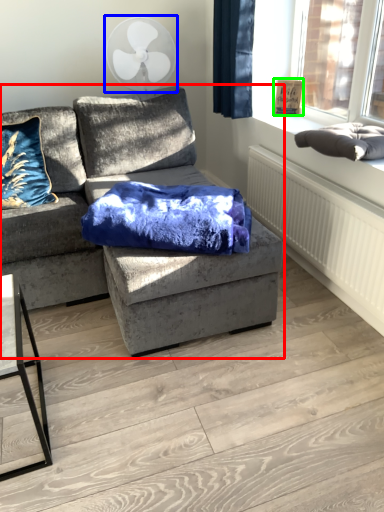
Question: Which is nearer to the studio couch (highlighted by a red box)? mechanical fan (highlighted by a blue box) or picture frame (highlighted by a green box).

Choices:
 (A) mechanical fan
 (B) picture frame

Answer: (A)